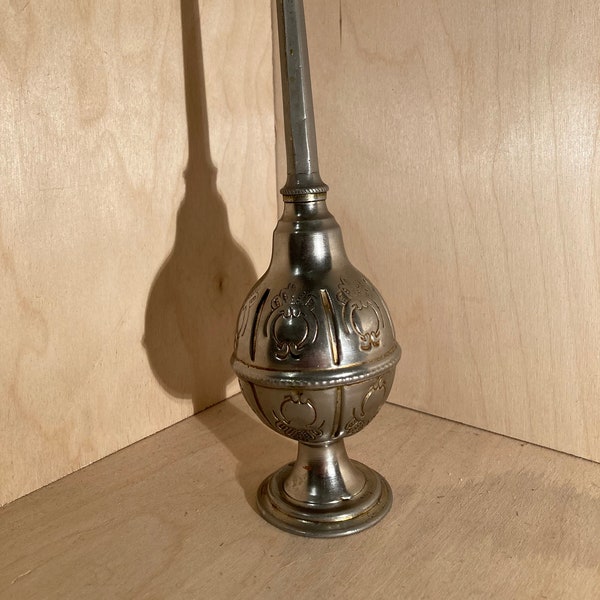
Identify the location of rod. (304, 113).